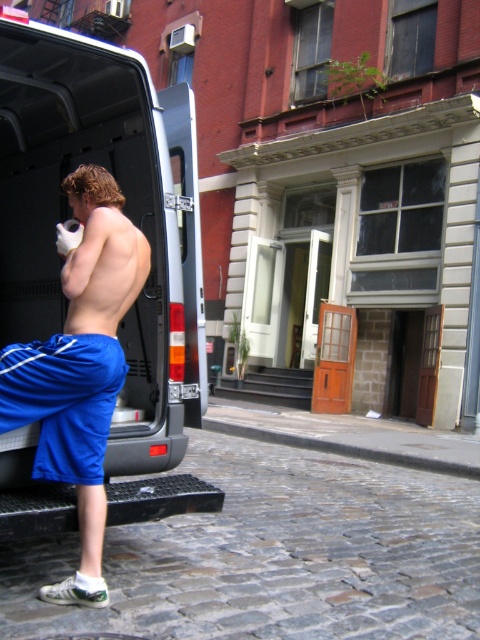
Which is more to the left, white matte van at center or blue fabric shorts at center?

white matte van at center is more to the left.

Is the position of white matte van at center more distant than that of blue fabric shorts at center?

That is True.

The height and width of the screenshot is (640, 480). Find the location of `white matte van at center`. white matte van at center is located at coordinates (123, 211).

Does blue fabric shorts at center appear over blue fabric shorts at lower left?

Correct, blue fabric shorts at center is located above blue fabric shorts at lower left.

Does blue fabric shorts at center have a greater height compared to blue fabric shorts at lower left?

Yes, blue fabric shorts at center is taller than blue fabric shorts at lower left.

I want to click on blue fabric shorts at center, so click(x=80, y=365).

You are a GUI agent. You are given a task and a screenshot of the screen. Output one action in this format:
    pyautogui.click(x=<x>, y=<y>)
    Task: Click on the blue fabric shorts at center
    This screenshot has width=480, height=640.
    Given the screenshot: What is the action you would take?
    pyautogui.click(x=80, y=365)

Based on the photo, can you confirm if white matte van at center is thinner than blue fabric shorts at lower left?

In fact, white matte van at center might be wider than blue fabric shorts at lower left.

Looking at this image, can you confirm if white matte van at center is smaller than blue fabric shorts at lower left?

No, white matte van at center is not smaller than blue fabric shorts at lower left.

Between point (34, 81) and point (0, 358), which one is positioned behind?

The point (34, 81) is behind.

Locate an element on the screen. This screenshot has height=640, width=480. white matte van at center is located at coordinates (123, 211).